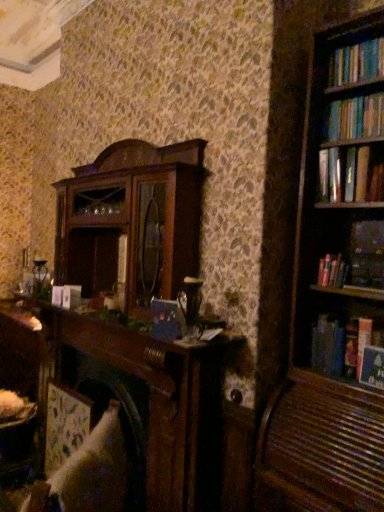
Question: Is hardcover book at upper right, the first book from the bottom, smaller than hardcover book at right, positioned as the 4th book in bottom-to-top order?

Choices:
 (A) no
 (B) yes

Answer: (B)

Question: Is hardcover book at upper right, the first book from the bottom, located outside hardcover book at right, positioned as the 4th book in bottom-to-top order?

Choices:
 (A) no
 (B) yes

Answer: (B)

Question: Is hardcover book at right, positioned as the 4th book in bottom-to-top order, completely or partially inside hardcover book at upper right, the fifth book in the top-to-bottom sequence?

Choices:
 (A) no
 (B) yes

Answer: (A)

Question: From a real-world perspective, is hardcover book at upper right, the fifth book in the top-to-bottom sequence, located higher than hardcover book at right, positioned as the 4th book in bottom-to-top order?

Choices:
 (A) yes
 (B) no

Answer: (B)

Question: Does hardcover book at upper right, the first book from the bottom, lie behind hardcover book at right, which is counted as the second book, starting from the top?

Choices:
 (A) no
 (B) yes

Answer: (A)

Question: Looking at their shapes, would you say hardcover book at right, which is counted as the second book, starting from the top, is wider or thinner than hardcover book at right, the third book from the top?

Choices:
 (A) wide
 (B) thin

Answer: (A)

Question: Considering their positions, is hardcover book at right, positioned as the 4th book in bottom-to-top order, located in front of or behind hardcover book at right, positioned as the 3th book in bottom-to-top order?

Choices:
 (A) behind
 (B) front

Answer: (B)

Question: From the image's perspective, is hardcover book at right, which is counted as the second book, starting from the top, above or below hardcover book at right, the third book from the top?

Choices:
 (A) above
 (B) below

Answer: (A)

Question: From a real-world perspective, is hardcover book at right, positioned as the 4th book in bottom-to-top order, positioned above or below hardcover book at right, the third book from the top?

Choices:
 (A) above
 (B) below

Answer: (A)

Question: In the image, is hardcover book at upper right, the first book from the bottom, on the left side or the right side of hardcover book at right, which is counted as the fourth book, starting from the top?

Choices:
 (A) left
 (B) right

Answer: (B)

Question: Considering the positions of point (369, 381) and point (331, 339), is point (369, 381) closer or farther from the camera than point (331, 339)?

Choices:
 (A) closer
 (B) farther

Answer: (A)

Question: From their relative heights in the image, would you say hardcover book at upper right, the first book from the bottom, is taller or shorter than hardcover book at right, which is counted as the fourth book, starting from the top?

Choices:
 (A) tall
 (B) short

Answer: (B)

Question: From the image's perspective, is hardcover book at upper right, the first book from the bottom, located above or below hardcover book at right, which is counted as the fourth book, starting from the top?

Choices:
 (A) below
 (B) above

Answer: (A)

Question: Is white fabric swivel chair at lower left in front of or behind hardcover book at right, which is counted as the second book, starting from the top, in the image?

Choices:
 (A) behind
 (B) front

Answer: (B)

Question: Is white fabric swivel chair at lower left inside the boundaries of hardcover book at right, positioned as the 4th book in bottom-to-top order, or outside?

Choices:
 (A) inside
 (B) outside

Answer: (B)